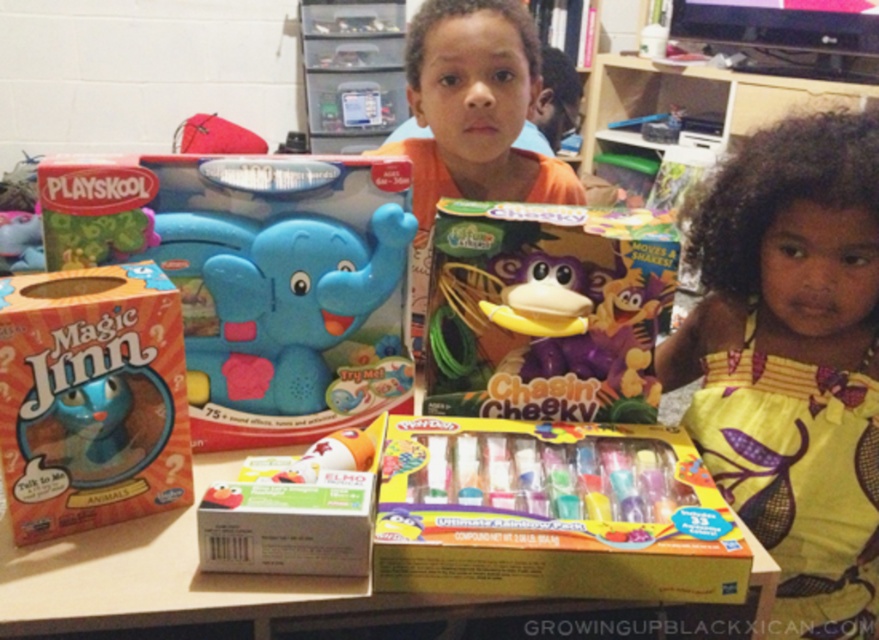
You have a small toy car that needs to fit into either the yellow cardboard box at center or the matte plastic elephant at center. Based on their sizes, which container is more suitable for the toy car?

The yellow cardboard box at center is larger in size than the matte plastic elephant at center, so the toy car would fit better in the yellow cardboard box at center.